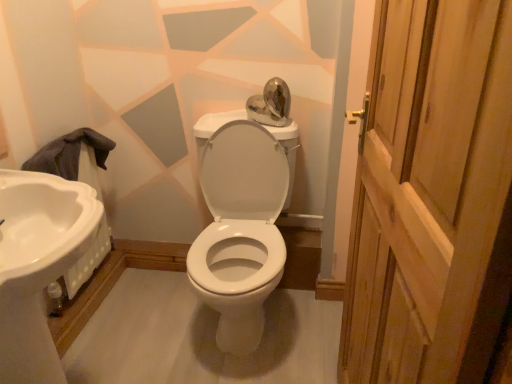
Find the location of `free point below white glossy porcelain at center (from a real-world perspective)`. free point below white glossy porcelain at center (from a real-world perspective) is located at coordinates (214, 327).